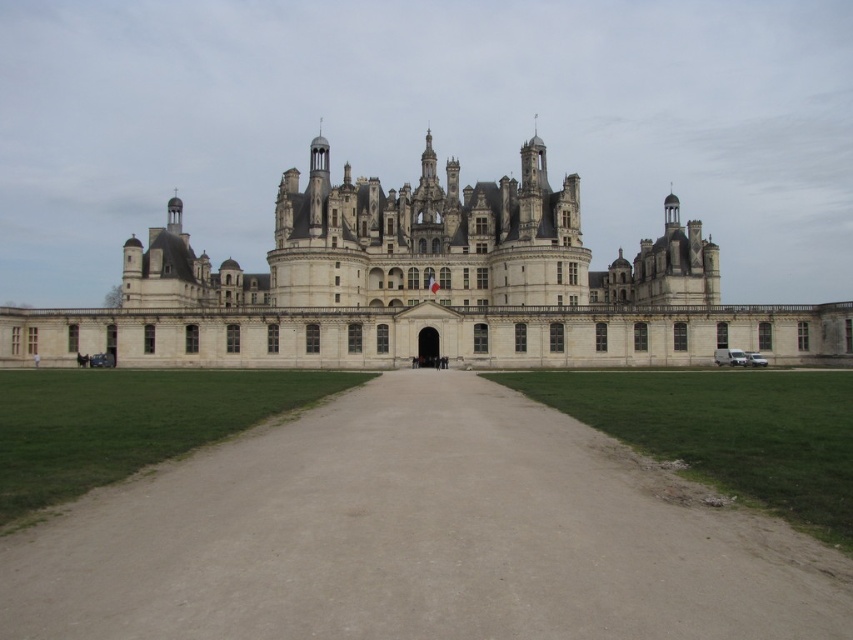
You are standing on the dirt path at center and want to walk directly towards the white stone castle at center. In which direction should you head?

The dirt path at center is to the right of white stone castle at center, so you should head to the left to walk directly towards the white stone castle at center.

You are standing at the castle entrance and want to reach the dirt path at center. Which direction should you walk to reach it?

The dirt path at center is located at point (416,538), so you should walk forward towards the center to reach it.